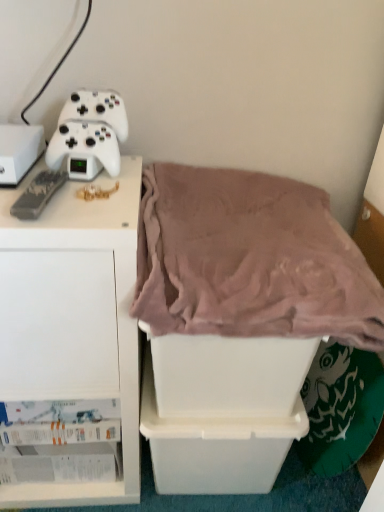
Identify the location of vacant space to the right of black matte game controller at left, which is the second game controller in back-to-front order. The image size is (384, 512). (99, 203).